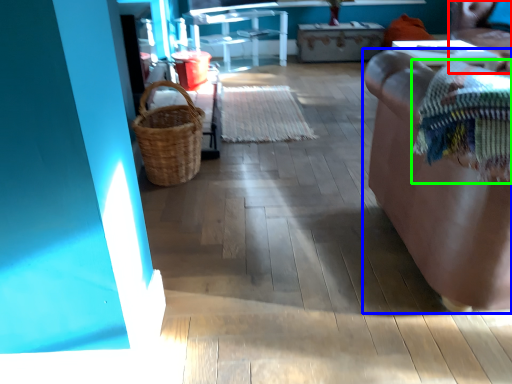
Question: Considering the real-world distances, which object is farthest from chair (highlighted by a red box)? furniture (highlighted by a blue box) or blanket (highlighted by a green box)?

Choices:
 (A) furniture
 (B) blanket

Answer: (B)